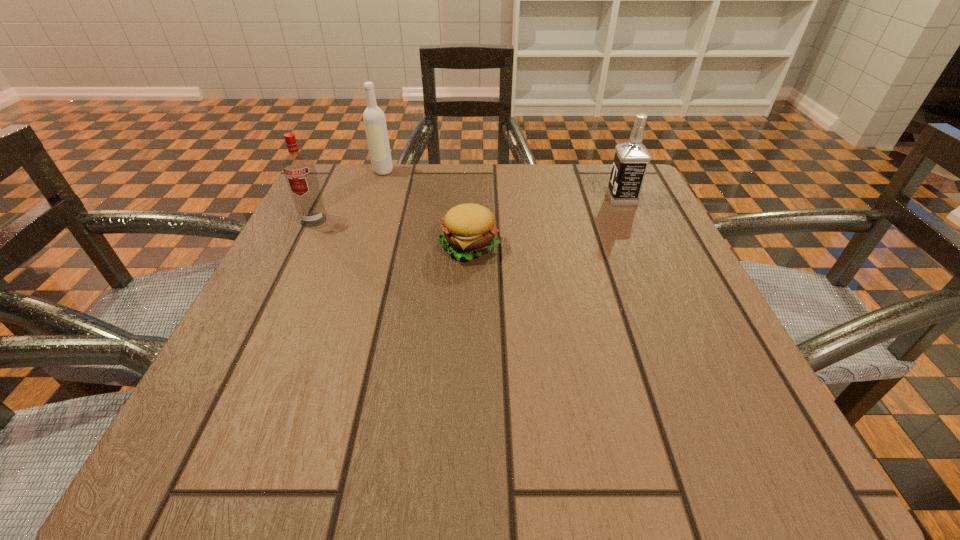
Image resolution: width=960 pixels, height=540 pixels. Identify the location of the third object from right to left. (374, 119).

What are the coordinates of `the second vodka from right to left` in the screenshot? It's located at (374, 119).

Locate an element on the screen. The width and height of the screenshot is (960, 540). the rightmost vodka is located at coordinates (631, 159).

The image size is (960, 540). Find the location of `the third nearest object`. the third nearest object is located at coordinates (631, 159).

The width and height of the screenshot is (960, 540). Identify the location of the leftmost object. (299, 169).

Image resolution: width=960 pixels, height=540 pixels. I want to click on the leftmost vodka, so (x=299, y=169).

This screenshot has height=540, width=960. In order to click on the shortest object in this screenshot , I will do `click(468, 231)`.

The image size is (960, 540). I want to click on the third object from left to right, so click(x=468, y=231).

Locate an element on the screen. free space located on the right of the farthest object is located at coordinates (557, 171).

This screenshot has width=960, height=540. What are the coordinates of `vacant space located on the front label of the second farthest object` in the screenshot? It's located at (462, 199).